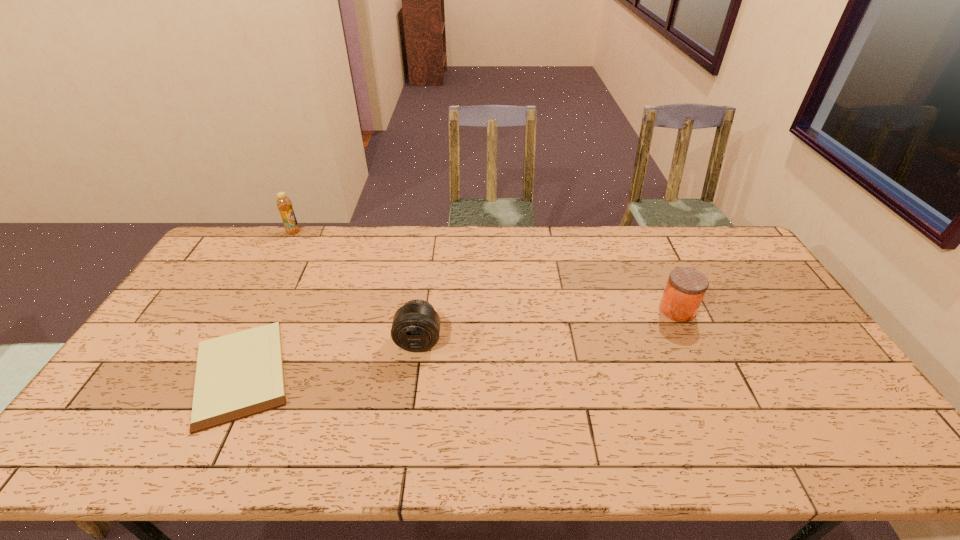
Locate an element on the screen. The height and width of the screenshot is (540, 960). free spot between the telephoto lens and the rightmost object is located at coordinates (548, 326).

At what (x,y) coordinates should I click in order to perform the action: click on object that stands as the second closest to the rightmost object. Please return your answer as a coordinate pair (x, y). Looking at the image, I should click on (239, 375).

Choose which object is the second nearest neighbor to the tallest object. Please provide its 2D coordinates. Your answer should be formatted as a tuple, i.e. [(x, y)], where the tuple contains the x and y coordinates of a point satisfying the conditions above.

[(416, 325)]

The width and height of the screenshot is (960, 540). Identify the location of vacant region that satisfies the following two spatial constraints: 1. on the front side of the tallest object; 2. on the right side of the rightmost object. (251, 310).